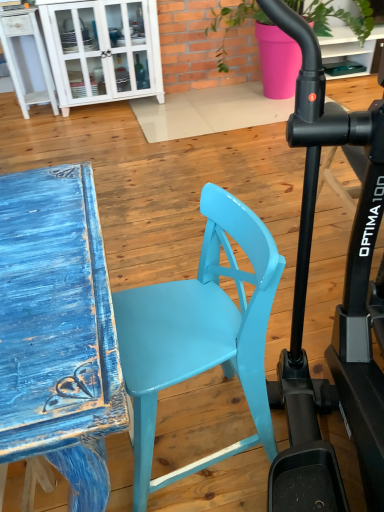
Question: In terms of size, does matte pink pot at upper center appear bigger or smaller than white glossy cabinet at upper left?

Choices:
 (A) big
 (B) small

Answer: (A)

Question: Looking at their shapes, would you say matte pink pot at upper center is wider or thinner than white glossy cabinet at upper left?

Choices:
 (A) thin
 (B) wide

Answer: (B)

Question: Estimate the real-world distances between objects in this image. Which object is closer to the glossy plastic chair at center?

Choices:
 (A) matte pink pot at upper center
 (B) white glossy cabinet at upper left

Answer: (B)

Question: Which is nearer to the white glossy cabinet at upper left?

Choices:
 (A) matte pink pot at upper center
 (B) glossy plastic chair at center

Answer: (A)